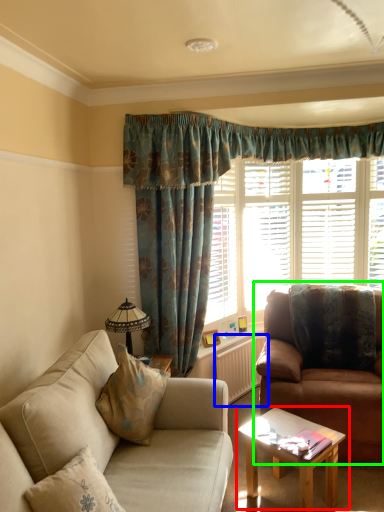
Question: Considering the real-world distances, which object is closest to coffee table (highlighted by a red box)? radiator (highlighted by a blue box) or studio couch (highlighted by a green box).

Choices:
 (A) radiator
 (B) studio couch

Answer: (B)